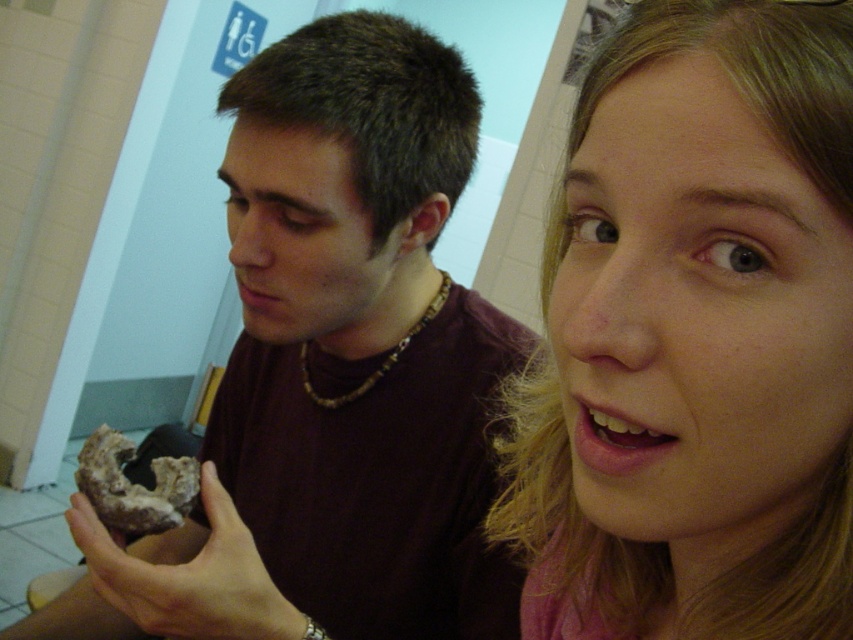
In the scene shown: Which of these two, blonde hair at upper right or matte brown donut at center, stands shorter?

With less height is blonde hair at upper right.

Can you confirm if blonde hair at upper right is smaller than matte brown donut at center?

Indeed, blonde hair at upper right has a smaller size compared to matte brown donut at center.

Is point (682, 88) positioned before point (396, 413)?

Yes.

Identify the location of blonde hair at upper right. This screenshot has width=853, height=640. (695, 337).

Does point (282, 220) come in front of point (207, 468)?

No, (282, 220) is further to viewer.

How distant is matte brown donut at center from brown textured mushroom at lower left?

4.84 inches

The width and height of the screenshot is (853, 640). What are the coordinates of `matte brown donut at center` in the screenshot? It's located at (335, 369).

Which of these two, blonde hair at upper right or chocolate glazed donut at lower left, stands shorter?

chocolate glazed donut at lower left

Between blonde hair at upper right and chocolate glazed donut at lower left, which one appears on the right side from the viewer's perspective?

From the viewer's perspective, blonde hair at upper right appears more on the right side.

Does point (788, 259) come closer to viewer compared to point (141, 472)?

Yes, it is in front of point (141, 472).

The image size is (853, 640). Identify the location of blonde hair at upper right. (695, 337).